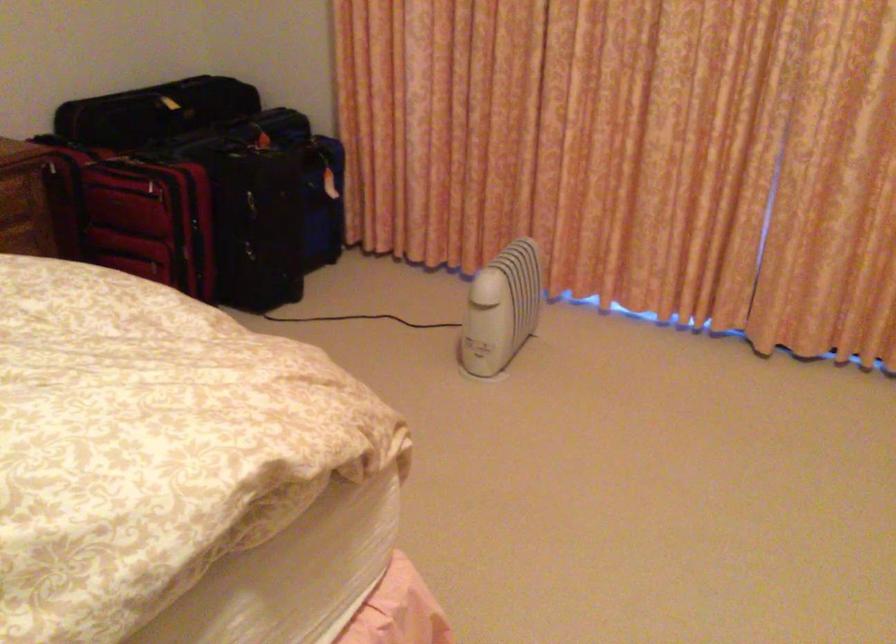
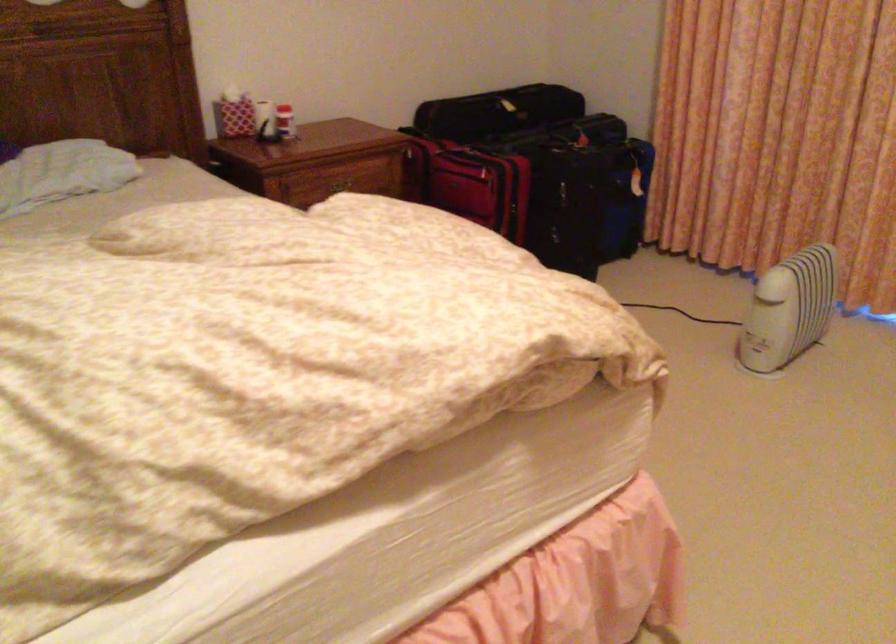
Locate, in the second image, the point that corresponds to (323,213) in the first image.

(625, 199)